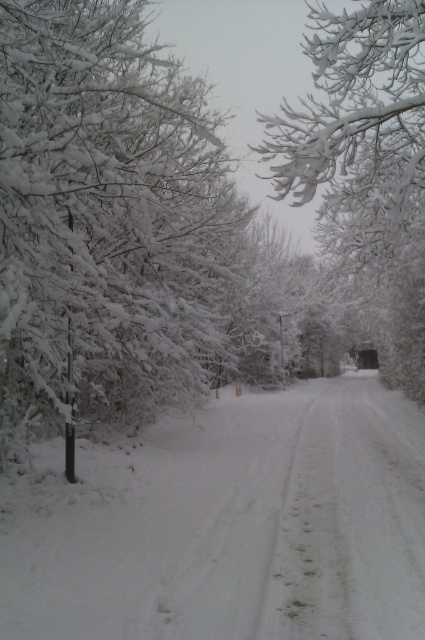
Can you confirm if white fluffy snow at center is taller than white frosty tree at left?

No.

Who is taller, white fluffy snow at center or white frosty tree at left?

white frosty tree at left

Which is in front, point (252, 445) or point (115, 179)?

Positioned in front is point (115, 179).

At what (x,y) coordinates should I click in order to perform the action: click on white fluffy snow at center. Please return your answer as a coordinate pair (x, y). This screenshot has width=425, height=640. Looking at the image, I should click on (229, 524).

From the picture: Is white fluffy snow at center positioned in front of white frosty branches at upper center?

Yes, it is.

Is point (393, 605) positioned in front of point (351, 67)?

Yes.

Describe the element at coordinates (229, 524) in the screenshot. This screenshot has height=640, width=425. I see `white fluffy snow at center` at that location.

I want to click on white fluffy snow at center, so click(x=229, y=524).

Is white frosty tree at left bigger than white frosty branches at upper center?

No.

Who is positioned more to the right, white frosty tree at left or white frosty branches at upper center?

white frosty branches at upper center

Which is in front, point (170, 97) or point (390, 268)?

Positioned in front is point (170, 97).

Find the location of a particular element. white frosty tree at left is located at coordinates [x=102, y=218].